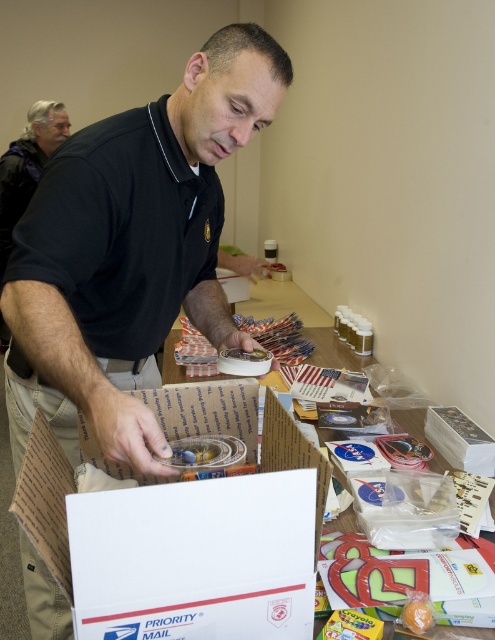
You are a delivery person who needs to determine if the black matte shirt at center can be placed into the white cardboard box at center without folding it. Can you do that?

The black matte shirt at center is bigger than the white cardboard box at center, so it cannot fit inside without folding.